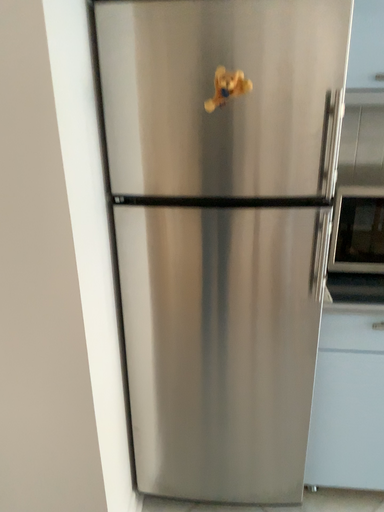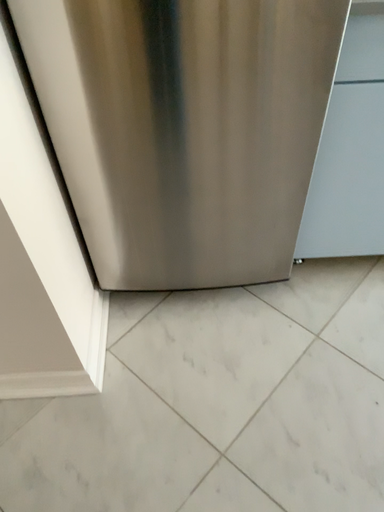
Question: Which way did the camera rotate in the video?

Choices:
 (A) rotated left
 (B) rotated right

Answer: (B)